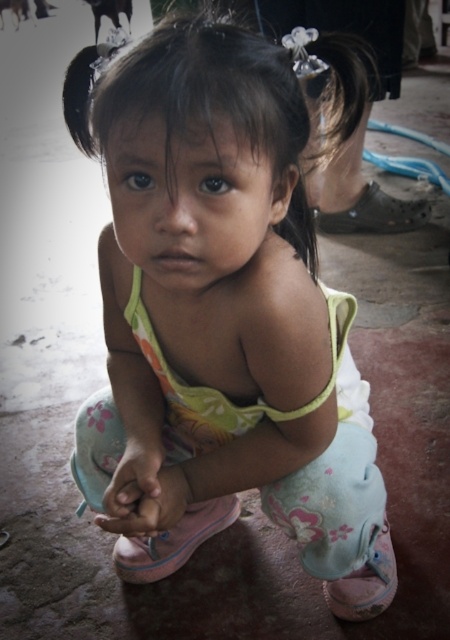
You are a GUI agent. You are given a task and a screenshot of the screen. Output one action in this format:
    pyautogui.click(x=<x>, y=<y>)
    Task: Click on the light pink fabric hand at center
    Image resolution: width=450 pixels, height=640 pixels.
    Given the screenshot: What is the action you would take?
    pyautogui.click(x=149, y=502)

Find the location of a particular element. This screenshot has width=450, height=640. light pink fabric hand at center is located at coordinates tap(149, 502).

Where is `light pink fabric hand at center`? light pink fabric hand at center is located at coordinates click(x=149, y=502).

Consider the image. Which is below, pastel floral dress at center or light pink fabric hand at center?

light pink fabric hand at center is below.

This screenshot has width=450, height=640. What do you see at coordinates (225, 307) in the screenshot?
I see `pastel floral dress at center` at bounding box center [225, 307].

Where is `pastel floral dress at center`? pastel floral dress at center is located at coordinates (225, 307).

Is pastel floral dress at center shorter than pink fabric hand at center?

No.

At what (x,y) coordinates should I click in order to perform the action: click on pastel floral dress at center. Please return your answer as a coordinate pair (x, y). The width and height of the screenshot is (450, 640). Looking at the image, I should click on (225, 307).